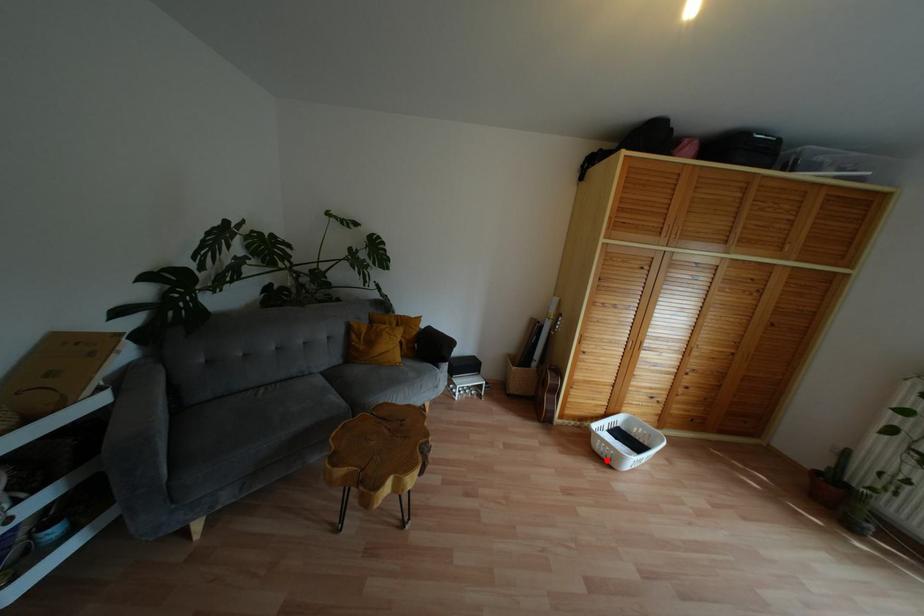
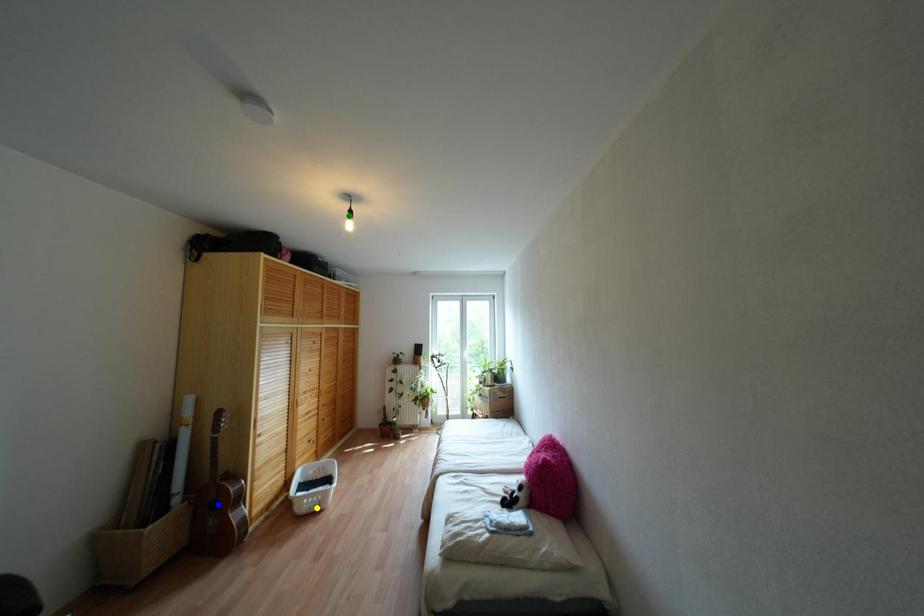
Question: I am providing you with two images of the same scene from different viewpoints. A red point is marked on the first image. You are given multiple points on the second image. Which point in image 2 represents the same 3d spot as the red point in image 1?

Choices:
 (A) green point
 (B) blue point
 (C) yellow point

Answer: (C)